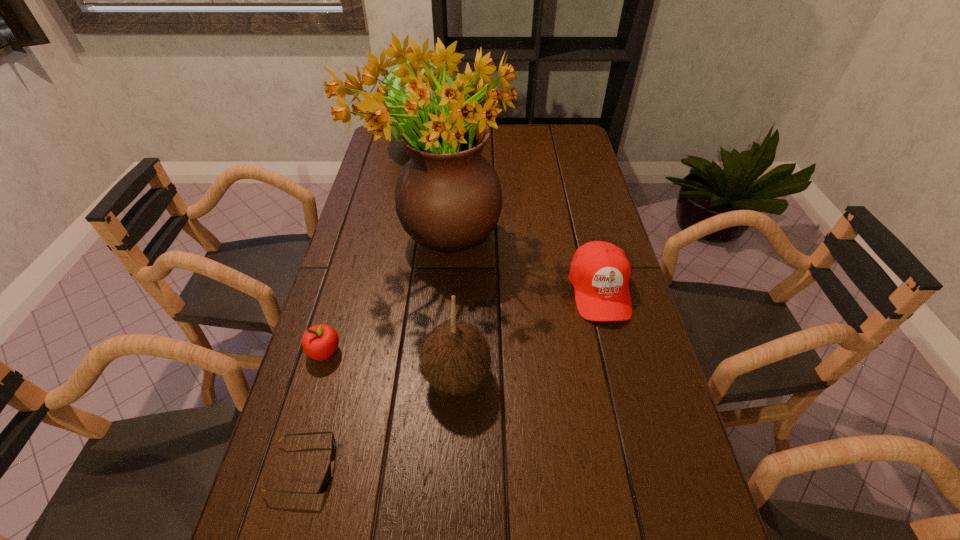
Where is `free point between the flower arrangement and the sunglasses`? Image resolution: width=960 pixels, height=540 pixels. free point between the flower arrangement and the sunglasses is located at coordinates (371, 353).

You are a GUI agent. You are given a task and a screenshot of the screen. Output one action in this format:
    pyautogui.click(x=<x>, y=<y>)
    Task: Click on the vacant area that lies between the coconut and the tallest object
    
    Given the screenshot: What is the action you would take?
    pyautogui.click(x=447, y=308)

I want to click on empty space between the second tallest object and the second shortest object, so click(x=375, y=248).

The image size is (960, 540). I want to click on empty location between the farthest object and the apple, so click(x=375, y=248).

This screenshot has width=960, height=540. I want to click on empty location between the baseball cap and the watermelon, so click(x=513, y=218).

Locate an element on the screen. the fifth closest object relative to the watermelon is located at coordinates [x=325, y=482].

Identify which object is the fifth closest to the fifth tallest object. Please provide its 2D coordinates. Your answer should be formatted as a tuple, i.e. [(x, y)], where the tuple contains the x and y coordinates of a point satisfying the conditions above.

[(395, 81)]

I want to click on free spot that satisfies the following two spatial constraints: 1. on the front panel of the rightmost object; 2. on the surface of the third tallest object, so click(621, 377).